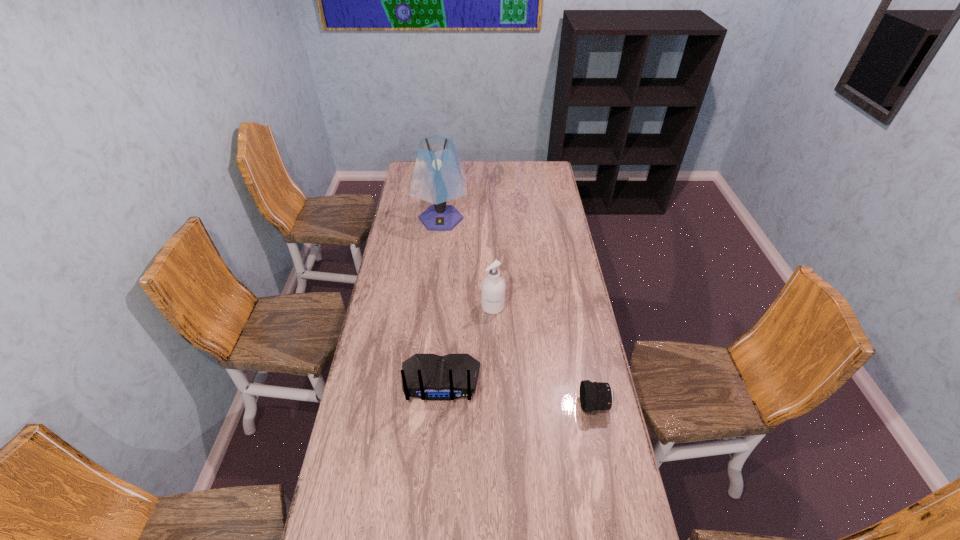
Identify the location of vacant space located at the front element of the telephoto lens. (513, 404).

Find the location of a particular element. This screenshot has width=960, height=540. free region located at the front element of the telephoto lens is located at coordinates (516, 404).

Where is `vacant space positioned at the front element of the telephoto lens`? This screenshot has height=540, width=960. vacant space positioned at the front element of the telephoto lens is located at coordinates (484, 404).

Locate an element on the screen. lampshade that is at the left edge is located at coordinates (438, 176).

At what (x,y) coordinates should I click in order to perform the action: click on router located in the left edge section of the desktop. Please return your answer as a coordinate pair (x, y). The height and width of the screenshot is (540, 960). Looking at the image, I should click on (431, 377).

You are a GUI agent. You are given a task and a screenshot of the screen. Output one action in this format:
    pyautogui.click(x=<x>, y=<y>)
    Task: Click on the object at the right edge
    The image size is (960, 540).
    Given the screenshot: What is the action you would take?
    pyautogui.click(x=594, y=396)

This screenshot has height=540, width=960. In order to click on free space at the far edge of the desktop in this screenshot , I will do `click(508, 164)`.

The height and width of the screenshot is (540, 960). Find the location of `vacant area at the left edge of the desktop`. vacant area at the left edge of the desktop is located at coordinates (347, 448).

I want to click on vacant space at the right edge of the desktop, so click(571, 440).

In the image, there is a desktop. At what (x,y) coordinates should I click in order to perform the action: click on vacant space at the far left corner. Please return your answer as a coordinate pair (x, y). This screenshot has width=960, height=540. Looking at the image, I should click on (409, 168).